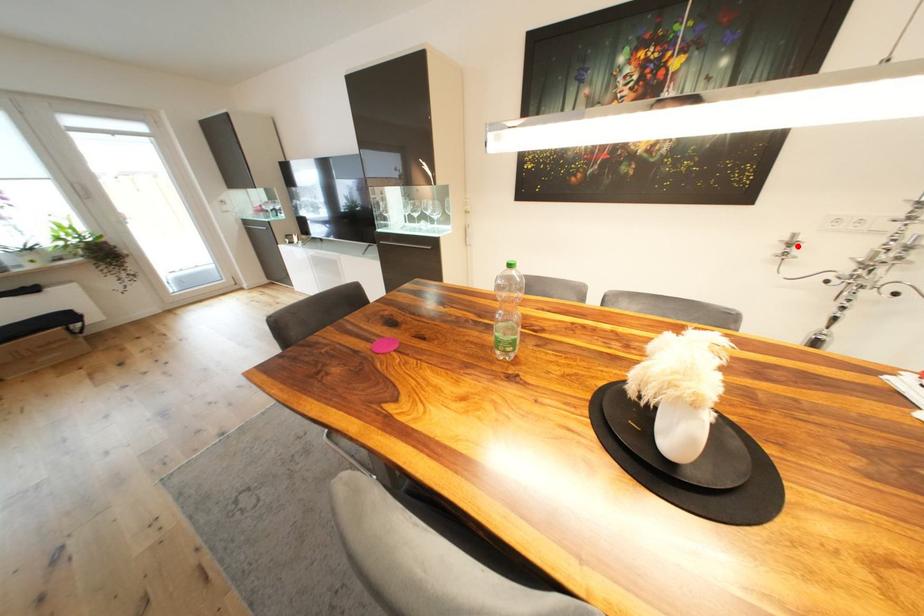
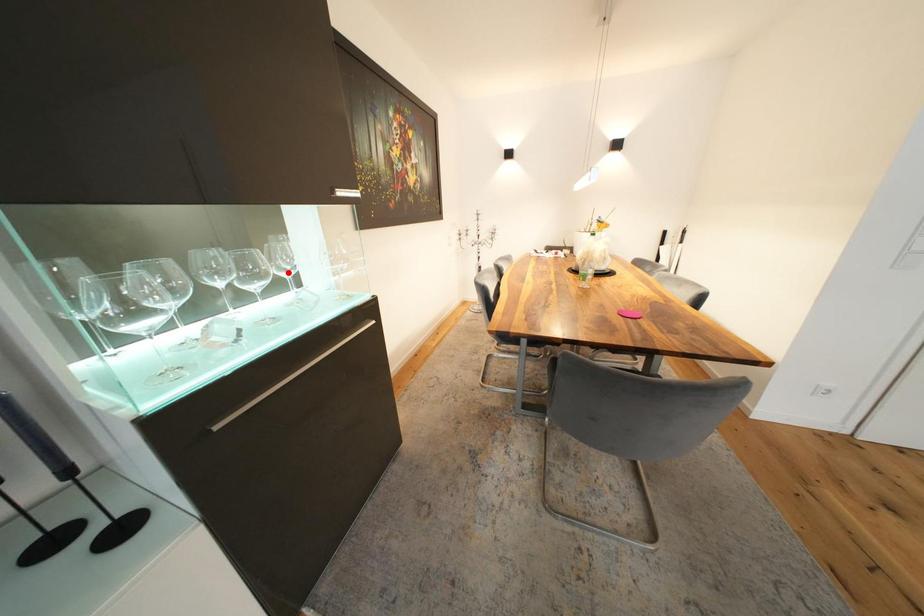
I am providing you with two images of the same scene from different viewpoints. A red point is marked on the first image and another point is marked on the second image. Do the highlighted points in image1 and image2 indicate the same real-world spot?

No